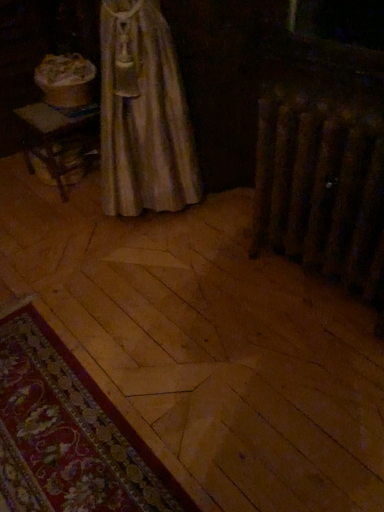
Locate an element on the screen. Image resolution: width=384 pixels, height=512 pixels. free spot to the left of rusty metal radiator at right is located at coordinates (223, 292).